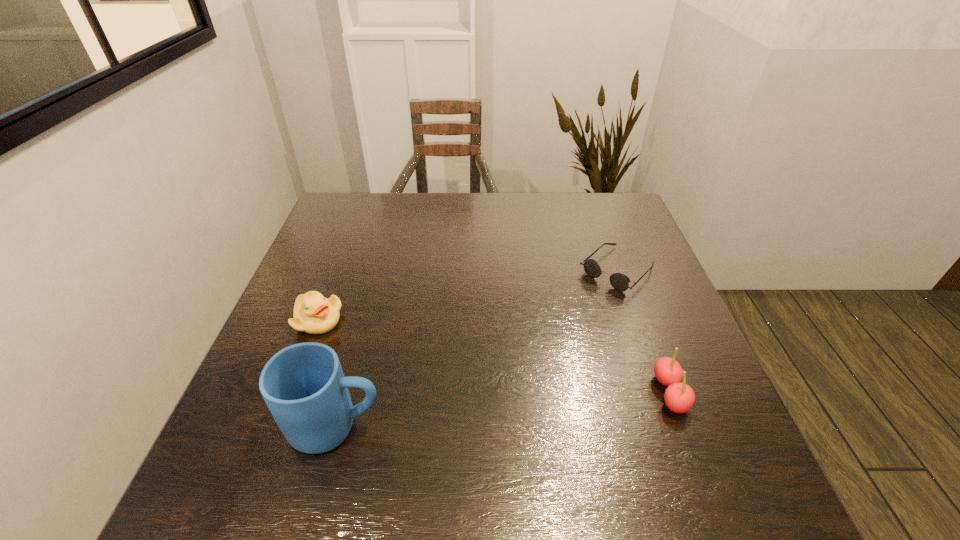
I want to click on object that is at the near right corner, so click(x=679, y=397).

Locate an element on the screen. The height and width of the screenshot is (540, 960). free space at the far edge is located at coordinates (577, 202).

In the image, there is a desktop. What are the coordinates of `vacant space at the near edge` in the screenshot? It's located at (637, 424).

Where is `free space at the left edge of the desktop`? free space at the left edge of the desktop is located at coordinates 346,237.

At what (x,y) coordinates should I click in order to perform the action: click on blank space at the right edge. Please return your answer as a coordinate pair (x, y). Image resolution: width=960 pixels, height=540 pixels. Looking at the image, I should click on (597, 257).

The width and height of the screenshot is (960, 540). In the image, there is a desktop. Find the location of `free region at the far left corner`. free region at the far left corner is located at coordinates (374, 218).

Find the location of `free point at the near left corner`. free point at the near left corner is located at coordinates (243, 445).

Locate an element on the screen. The width and height of the screenshot is (960, 540). free location at the far right corner is located at coordinates (637, 234).

You are a GUI agent. You are given a task and a screenshot of the screen. Output one action in this format:
    pyautogui.click(x=<x>, y=<y>)
    Task: Click on the free space between the farthest object and the tallest object
    
    Given the screenshot: What is the action you would take?
    pyautogui.click(x=477, y=348)

This screenshot has width=960, height=540. I want to click on vacant area that lies between the tallest object and the cherry, so click(503, 410).